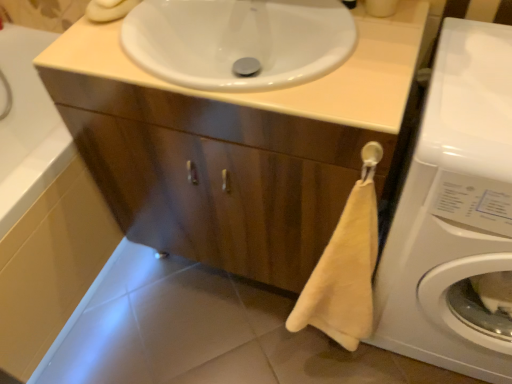
Question: Can you see wooden cabinet at center touching white glossy tile at lower center?

Choices:
 (A) no
 (B) yes

Answer: (A)

Question: Does wooden cabinet at center have a greater height compared to white glossy tile at lower center?

Choices:
 (A) no
 (B) yes

Answer: (B)

Question: From the image's perspective, is wooden cabinet at center on top of white glossy tile at lower center?

Choices:
 (A) no
 (B) yes

Answer: (B)

Question: From a real-world perspective, is wooden cabinet at center positioned over white glossy tile at lower center based on gravity?

Choices:
 (A) no
 (B) yes

Answer: (B)

Question: Considering the relative sizes of wooden cabinet at center and white glossy tile at lower center in the image provided, is wooden cabinet at center thinner than white glossy tile at lower center?

Choices:
 (A) no
 (B) yes

Answer: (A)

Question: From the image's perspective, is wooden cabinet at center beneath white glossy tile at lower center?

Choices:
 (A) no
 (B) yes

Answer: (A)

Question: Does white glossy sink at upper center have a greater height compared to white glossy tile at lower center?

Choices:
 (A) yes
 (B) no

Answer: (A)

Question: Is white glossy sink at upper center at the right side of white glossy tile at lower center?

Choices:
 (A) yes
 (B) no

Answer: (A)

Question: Is the position of white glossy sink at upper center less distant than that of white glossy tile at lower center?

Choices:
 (A) no
 (B) yes

Answer: (B)

Question: Can you confirm if white glossy sink at upper center is thinner than white glossy tile at lower center?

Choices:
 (A) yes
 (B) no

Answer: (B)

Question: Would you say white glossy tile at lower center is part of white glossy sink at upper center's contents?

Choices:
 (A) no
 (B) yes

Answer: (A)

Question: Is white glossy sink at upper center to the left of white glossy tile at lower center from the viewer's perspective?

Choices:
 (A) yes
 (B) no

Answer: (B)

Question: Are white glossy sink at upper center and white glossy washing machine at lower right located far from each other?

Choices:
 (A) yes
 (B) no

Answer: (B)